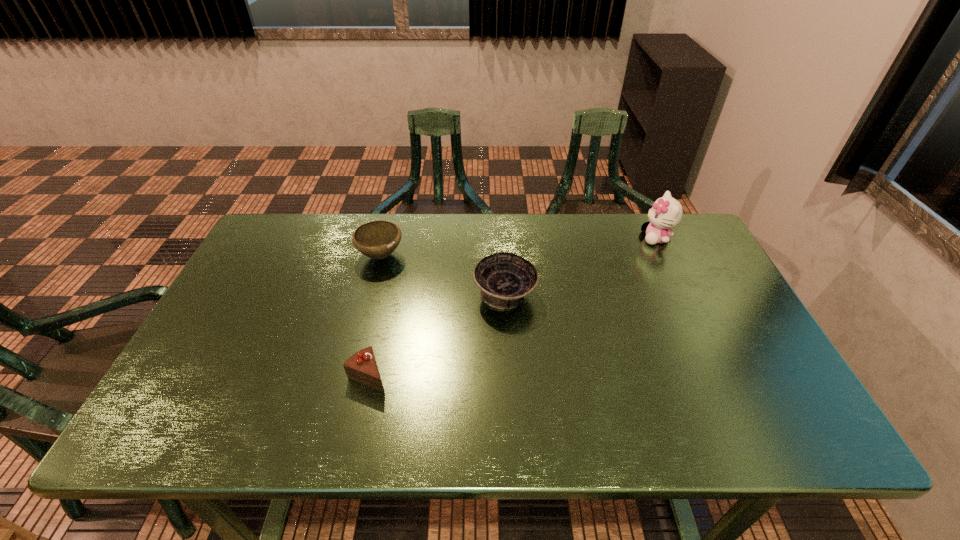
Where is `the second closest object relative to the nearest object`? The image size is (960, 540). the second closest object relative to the nearest object is located at coordinates coord(378,239).

Locate an element on the screen. vacant region that satisfies the following two spatial constraints: 1. on the front side of the farther bowl; 2. on the right side of the shortest object is located at coordinates (350, 377).